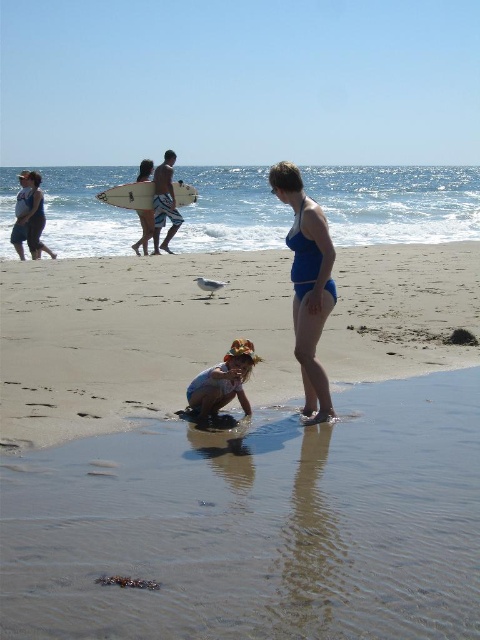
Question: Does blue water at upper center have a smaller size compared to white surfboard at center?

Choices:
 (A) yes
 (B) no

Answer: (B)

Question: Which of the following is the closest to the observer?

Choices:
 (A) (19, 212)
 (B) (97, 198)
 (C) (243, 179)

Answer: (A)

Question: Does matte blue bikini at center have a greater width compared to matte black swimsuit at left?

Choices:
 (A) yes
 (B) no

Answer: (A)

Question: Which of the following is the closest to the observer?

Choices:
 (A) matte blue bikini at center
 (B) blue denim shorts at lower center

Answer: (A)

Question: Which of the following is the farthest from the observer?

Choices:
 (A) white surfboard at center
 (B) matte blue bikini at center
 (C) blue water at upper center

Answer: (C)

Question: Is matte blue bikini at center to the right of blue denim shorts at lower center from the viewer's perspective?

Choices:
 (A) yes
 (B) no

Answer: (A)